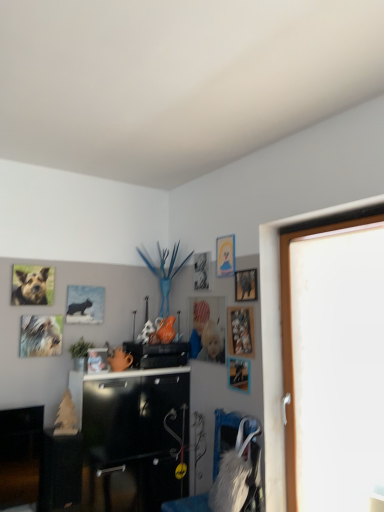
Question: Can you confirm if metallic silver picture frame at center, placed as the second picture frame when sorted from left to right, is wider than metallic silver photo frame at upper center, positioned as the sixth picture frame in right-to-left order?

Choices:
 (A) no
 (B) yes

Answer: (B)

Question: Considering the relative positions of metallic silver picture frame at center, placed as the second picture frame when sorted from left to right, and metallic silver photo frame at upper center, positioned as the sixth picture frame in right-to-left order, in the image provided, is metallic silver picture frame at center, placed as the second picture frame when sorted from left to right, to the left of metallic silver photo frame at upper center, positioned as the sixth picture frame in right-to-left order, from the viewer's perspective?

Choices:
 (A) no
 (B) yes

Answer: (B)

Question: Does metallic silver picture frame at center, the 7th picture frame viewed from the right, lie behind metallic silver photo frame at upper center, positioned as the 3th picture frame in left-to-right order?

Choices:
 (A) no
 (B) yes

Answer: (A)

Question: Is metallic silver picture frame at center, the 7th picture frame viewed from the right, with metallic silver photo frame at upper center, positioned as the sixth picture frame in right-to-left order?

Choices:
 (A) no
 (B) yes

Answer: (A)

Question: Would you say metallic silver picture frame at center, placed as the second picture frame when sorted from left to right, is outside metallic silver photo frame at upper center, positioned as the sixth picture frame in right-to-left order?

Choices:
 (A) yes
 (B) no

Answer: (A)

Question: Is point (170, 503) closer or farther from the camera than point (243, 340)?

Choices:
 (A) closer
 (B) farther

Answer: (B)

Question: Is white furry swivel chair at center in front of or behind wooden picture frame at upper right, which is the 2th picture frame from right to left, in the image?

Choices:
 (A) front
 (B) behind

Answer: (A)

Question: In terms of height, does white furry swivel chair at center look taller or shorter compared to wooden picture frame at upper right, which is the 2th picture frame from right to left?

Choices:
 (A) tall
 (B) short

Answer: (A)

Question: Is white furry swivel chair at center to the left or to the right of wooden picture frame at upper right, which ranks as the seventh picture frame in left-to-right order, in the image?

Choices:
 (A) right
 (B) left

Answer: (B)

Question: Choose the correct answer: Is wooden picture frame at upper right, which ranks as the seventh picture frame in left-to-right order, inside matte plastic picture frame at center, arranged as the fifth picture frame when viewed from the right, or outside it?

Choices:
 (A) outside
 (B) inside

Answer: (A)

Question: From the image's perspective, is wooden picture frame at upper right, which is the 2th picture frame from right to left, positioned above or below matte plastic picture frame at center, arranged as the fifth picture frame when viewed from the right?

Choices:
 (A) above
 (B) below

Answer: (A)

Question: Considering the positions of wooden picture frame at upper right, which ranks as the seventh picture frame in left-to-right order, and matte plastic picture frame at center, arranged as the fifth picture frame when viewed from the right, in the image, is wooden picture frame at upper right, which ranks as the seventh picture frame in left-to-right order, wider or thinner than matte plastic picture frame at center, arranged as the fifth picture frame when viewed from the right,?

Choices:
 (A) wide
 (B) thin

Answer: (B)

Question: Would you say wooden picture frame at upper right, which ranks as the seventh picture frame in left-to-right order, is to the left or to the right of matte plastic picture frame at center, arranged as the fifth picture frame when viewed from the right, in the picture?

Choices:
 (A) right
 (B) left

Answer: (A)

Question: Is point (251, 349) positioned closer to the camera than point (74, 301)?

Choices:
 (A) farther
 (B) closer

Answer: (B)

Question: Looking at the image, does wooden picture frame at upper right, which is the 2th picture frame from right to left, seem bigger or smaller compared to matte black picture frame at upper left, the first picture frame in the left-to-right sequence?

Choices:
 (A) big
 (B) small

Answer: (B)